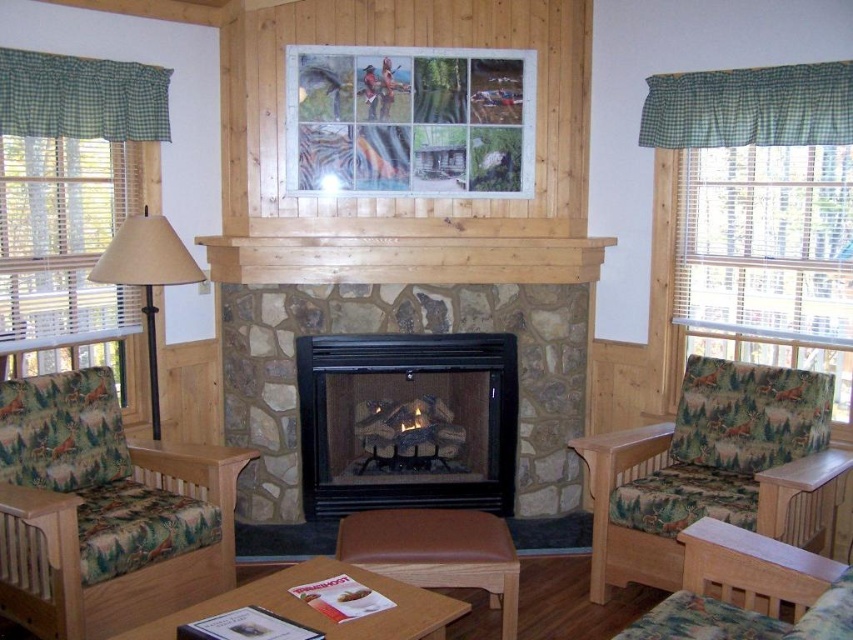
Question: Which point is farther to the camera?

Choices:
 (A) patterned fabric chair at left
 (B) wooden frame at center
 (C) beige fabric lampshade at left

Answer: (B)

Question: Is patterned fabric armchair at lower right thinner than leather ottoman at center?

Choices:
 (A) yes
 (B) no

Answer: (A)

Question: Is patterned fabric armchair at lower right to the right of wooden coffee table at center from the viewer's perspective?

Choices:
 (A) yes
 (B) no

Answer: (A)

Question: Does black stone fireplace at center appear on the right side of wooden coffee table at center?

Choices:
 (A) no
 (B) yes

Answer: (B)

Question: Estimate the real-world distances between objects in this image. Which object is closer to the wooden frame at center?

Choices:
 (A) patterned fabric armchair at lower right
 (B) leather ottoman at center
 (C) patterned fabric chair at left

Answer: (C)

Question: Which point is closer to the camera taking this photo?

Choices:
 (A) (383, 483)
 (B) (590, 568)

Answer: (B)